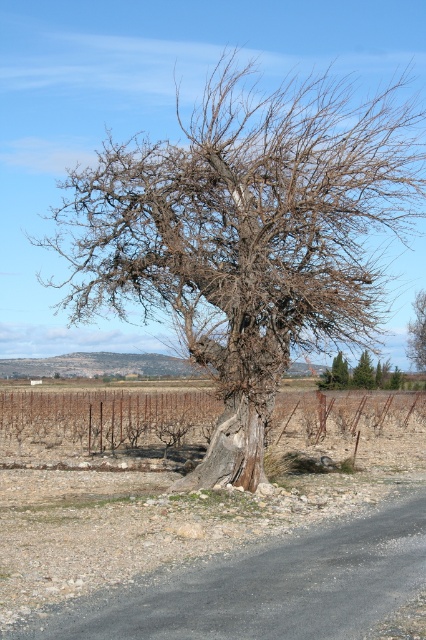
You are a landscape architect designing a new vineyard. You have two trees in the center of the proposed site. The green textured pine tree at center and the bark textured tree at center. Which tree has a wider trunk?

The green textured pine tree at center has a larger width than the bark textured tree at center according to the description.

In the scene shown: You are a landscape architect designing a new garden and want to place a bench between the bare wood tree at center and the green textured pine tree at center. Given that the bench requires 1.2 meters of space between the two trees to fit comfortably, can you determine if there is enough space based on their widths?

The bare wood tree at center has a larger width than the green textured pine tree at center, but the provided information only states their relative widths and does not specify the distance between them. Without knowing the actual distance between the two trees, it is impossible to determine if the 1.2 meters of space required for the bench is available.